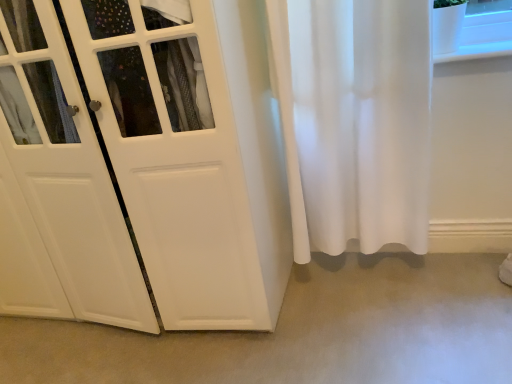
Question: From the image's perspective, is white matte door at center above or below beige carpet at lower center?

Choices:
 (A) below
 (B) above

Answer: (B)

Question: Is point (201, 299) positioned closer to the camera than point (310, 334)?

Choices:
 (A) closer
 (B) farther

Answer: (A)

Question: Is white matte door at center situated inside beige carpet at lower center or outside?

Choices:
 (A) outside
 (B) inside

Answer: (A)

Question: From the image's perspective, is beige carpet at lower center located above or below white matte door at center?

Choices:
 (A) above
 (B) below

Answer: (B)

Question: Is beige carpet at lower center inside or outside of white matte door at center?

Choices:
 (A) inside
 (B) outside

Answer: (B)

Question: Would you say beige carpet at lower center is to the left or to the right of white matte door at center in the picture?

Choices:
 (A) left
 (B) right

Answer: (B)

Question: From a real-world perspective, relative to white matte door at center, is beige carpet at lower center vertically above or below?

Choices:
 (A) below
 (B) above

Answer: (A)